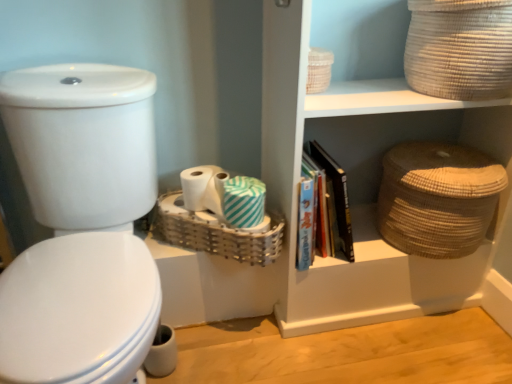
The width and height of the screenshot is (512, 384). What do you see at coordinates (333, 198) in the screenshot?
I see `hardcover book at center` at bounding box center [333, 198].

Describe the element at coordinates (216, 233) in the screenshot. I see `woven wicker basket at center, positioned as the 3th basket in right-to-left order` at that location.

What is the approximate width of woven wicker basket at center, positioned as the 3th basket in right-to-left order?

7.29 inches.

What do you see at coordinates (215, 191) in the screenshot? This screenshot has height=384, width=512. I see `white striped toilet paper at center, which appears as the first toilet paper when viewed from the left` at bounding box center [215, 191].

Describe the element at coordinates (244, 201) in the screenshot. The image size is (512, 384). I see `teal striped toilet paper at center, which is the second toilet paper in left-to-right order` at that location.

How much space does brown woven basket at right, which is counted as the 1th basket, starting from the right, occupy vertically?

The height of brown woven basket at right, which is counted as the 1th basket, starting from the right, is 11.18 inches.

What is the approximate width of woven beige basket at upper right, the 2th basket when ordered from left to right?

woven beige basket at upper right, the 2th basket when ordered from left to right, is 12.07 inches wide.

At what (x,y) coordinates should I click in order to perform the action: click on natural woven basket at upper right. Please return your answer as a coordinate pair (x, y). Looking at the image, I should click on (362, 184).

Does brown woven basket at right, which is counted as the 1th basket, starting from the right, appear on the right side of white paper roll at center?

Indeed, brown woven basket at right, which is counted as the 1th basket, starting from the right, is positioned on the right side of white paper roll at center.

From the image's perspective, which object appears higher, brown woven basket at right, which is counted as the 1th basket, starting from the right, or white paper roll at center?

white paper roll at center.

From a real-world perspective, starting from the white paper roll at center, which basket is the 1st one below it? Please provide its 2D coordinates.

[(438, 198)]

Does white paper roll at center touch teal striped toilet paper at center, which is the first toilet paper in right-to-left order?

Yes, white paper roll at center and teal striped toilet paper at center, which is the first toilet paper in right-to-left order, clearly make contact.

Based on the photo, who is smaller, white paper roll at center or teal striped toilet paper at center, which is the second toilet paper in left-to-right order?

With smaller size is teal striped toilet paper at center, which is the second toilet paper in left-to-right order.

From a real-world perspective, which is physically above, white paper roll at center or teal striped toilet paper at center, which is the first toilet paper in right-to-left order?

From a 3D spatial view, teal striped toilet paper at center, which is the first toilet paper in right-to-left order, is above.

Who is taller, white paper roll at center or teal striped toilet paper at center, which is the second toilet paper in left-to-right order?

teal striped toilet paper at center, which is the second toilet paper in left-to-right order.

From the image's perspective, would you say teal striped toilet paper at center, which is the first toilet paper in right-to-left order, is positioned over white striped toilet paper at center, which is the second toilet paper in right-to-left order?

No.

Is white striped toilet paper at center, which is the second toilet paper in right-to-left order, a part of teal striped toilet paper at center, which is the second toilet paper in left-to-right order?

No, white striped toilet paper at center, which is the second toilet paper in right-to-left order, is not inside teal striped toilet paper at center, which is the second toilet paper in left-to-right order.

Considering the positions of objects teal striped toilet paper at center, which is the second toilet paper in left-to-right order, and white striped toilet paper at center, which is the second toilet paper in right-to-left order, in the image provided, who is behind, teal striped toilet paper at center, which is the second toilet paper in left-to-right order, or white striped toilet paper at center, which is the second toilet paper in right-to-left order,?

white striped toilet paper at center, which is the second toilet paper in right-to-left order, is more distant.

Based on the photo, is brown woven basket at right, which is counted as the 1th basket, starting from the right, positioned far away from natural woven basket at upper right?

brown woven basket at right, which is counted as the 1th basket, starting from the right, is actually quite close to natural woven basket at upper right.

From the image's perspective, which one is positioned higher, brown woven basket at right, which is counted as the 1th basket, starting from the right, or natural woven basket at upper right?

natural woven basket at upper right.

From a real-world perspective, which is physically below, brown woven basket at right, positioned as the third basket in left-to-right order, or natural woven basket at upper right?

In real-world perspective, brown woven basket at right, positioned as the third basket in left-to-right order, is lower.

What's the angular difference between teal striped toilet paper at center, which is the second toilet paper in left-to-right order, and white glossy toilet at left's facing directions?

The angle between the facing direction of teal striped toilet paper at center, which is the second toilet paper in left-to-right order, and the facing direction of white glossy toilet at left is 2.78 degrees.

Which is in front, point (261, 195) or point (41, 175)?

Point (41, 175)

Which of these two, teal striped toilet paper at center, which is the second toilet paper in left-to-right order, or white glossy toilet at left, is thinner?

With smaller width is teal striped toilet paper at center, which is the second toilet paper in left-to-right order.

Would you say natural woven basket at upper right is part of white glossy toilet at left's contents?

That's incorrect, natural woven basket at upper right is not inside white glossy toilet at left.

Can you confirm if white glossy toilet at left is taller than natural woven basket at upper right?

In fact, white glossy toilet at left may be shorter than natural woven basket at upper right.

Which object is thinner, white glossy toilet at left or natural woven basket at upper right?

natural woven basket at upper right is thinner.

Which object is further away from the camera taking this photo, white glossy toilet at left or natural woven basket at upper right?

natural woven basket at upper right is further from the camera.

In the image, is woven wicker basket at center, positioned as the 3th basket in right-to-left order, positioned in front of or behind teal striped toilet paper at center, which is the second toilet paper in left-to-right order?

woven wicker basket at center, positioned as the 3th basket in right-to-left order, is positioned closer to the viewer than teal striped toilet paper at center, which is the second toilet paper in left-to-right order.

Is woven wicker basket at center, the 1th basket when ordered from left to right, thinner than teal striped toilet paper at center, which is the first toilet paper in right-to-left order?

In fact, woven wicker basket at center, the 1th basket when ordered from left to right, might be wider than teal striped toilet paper at center, which is the first toilet paper in right-to-left order.

Is the surface of woven wicker basket at center, positioned as the 3th basket in right-to-left order, in direct contact with teal striped toilet paper at center, which is the first toilet paper in right-to-left order?

Yes.

Starting from the white paper roll at center, which basket is the 3rd one to the right? Please provide its 2D coordinates.

[(438, 198)]

Locate an element on the screen. toiletry below the teal striped toilet paper at center, which is the first toilet paper in right-to-left order (from a real-world perspective) is located at coordinates (203, 188).

Looking at the image, which one is located further to white paper roll at center, hardcover book at center or natural woven basket at upper right?

Among the two, natural woven basket at upper right is located further to white paper roll at center.

Based on their spatial positions, is natural woven basket at upper right or white paper roll at center further from teal striped toilet paper at center, which is the first toilet paper in right-to-left order?

The object further to teal striped toilet paper at center, which is the first toilet paper in right-to-left order, is natural woven basket at upper right.

From the image, which object appears to be nearer to teal striped toilet paper at center, which is the first toilet paper in right-to-left order, woven wicker basket at center, the 1th basket when ordered from left to right, or white glossy toilet at left?

woven wicker basket at center, the 1th basket when ordered from left to right.

Based on their spatial positions, is natural woven basket at upper right or woven beige basket at upper right, which appears as the 2th basket when viewed from the right, closer to white paper roll at center?

natural woven basket at upper right.

From the image, which object appears to be nearer to brown woven basket at right, which is counted as the 1th basket, starting from the right, white glossy toilet at left or white paper roll at center?

white paper roll at center is closer to brown woven basket at right, which is counted as the 1th basket, starting from the right.

Consider the image. Estimate the real-world distances between objects in this image. Which object is closer to woven beige basket at upper right, the 2th basket when ordered from left to right, brown woven basket at right, which is counted as the 1th basket, starting from the right, or white paper roll at center?

brown woven basket at right, which is counted as the 1th basket, starting from the right, is closer to woven beige basket at upper right, the 2th basket when ordered from left to right.

When comparing their distances from woven wicker basket at center, the 1th basket when ordered from left to right, does white paper roll at center or natural woven basket at upper right seem further?

natural woven basket at upper right lies further to woven wicker basket at center, the 1th basket when ordered from left to right, than the other object.

In the scene shown: From the image, which object appears to be farther from woven beige basket at upper right, which appears as the 2th basket when viewed from the right, white glossy toilet at left or hardcover book at center?

Based on the image, white glossy toilet at left appears to be further to woven beige basket at upper right, which appears as the 2th basket when viewed from the right.

Identify the location of cabinet between woven wicker basket at center, positioned as the 3th basket in right-to-left order, and brown woven basket at right, positioned as the third basket in left-to-right order, from left to right. (362, 184).

The height and width of the screenshot is (384, 512). What are the coordinates of `magazine positioned between white glossy toilet at left and woven wicker basket at center, positioned as the 3th basket in right-to-left order, from near to far` in the screenshot? It's located at (333, 198).

Find the location of a particular element. magazine between white striped toilet paper at center, which is the second toilet paper in right-to-left order, and brown woven basket at right, which is counted as the 1th basket, starting from the right is located at coordinates (333, 198).

This screenshot has height=384, width=512. Identify the location of basket between teal striped toilet paper at center, which is the first toilet paper in right-to-left order, and brown woven basket at right, positioned as the third basket in left-to-right order, in the horizontal direction. (460, 48).